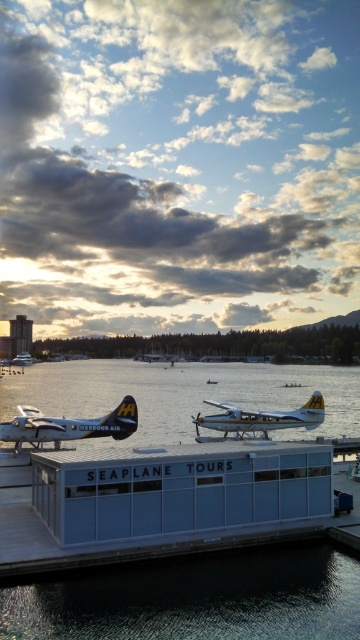
Question: Which point is farther to the camera?

Choices:
 (A) shiny silver seaplane at lower left
 (B) metallic silver seaplane at center
 (C) metallic silver boat at lower left
 (D) clear water at center

Answer: (C)

Question: Observing the image, what is the correct spatial positioning of shiny silver seaplane at lower left in reference to matte silver seaplane at center?

Choices:
 (A) below
 (B) above

Answer: (A)

Question: Does clear water at center appear under metallic silver seaplane at center?

Choices:
 (A) yes
 (B) no

Answer: (A)

Question: Which object appears closest to the camera in this image?

Choices:
 (A) matte silver seaplane at center
 (B) clear water at center

Answer: (B)

Question: Is clear water at center in front of metallic silver seaplane at center?

Choices:
 (A) no
 (B) yes

Answer: (B)

Question: Which of the following is the closest to the observer?

Choices:
 (A) shiny silver seaplane at lower left
 (B) matte silver seaplane at center
 (C) metallic silver boat at lower left

Answer: (B)